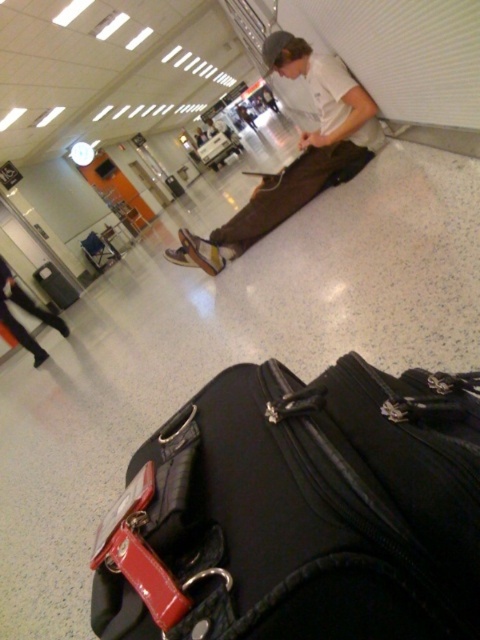
You are a traveler who just arrived at the airport and need to find your luggage. You see a black fabric suitcase at lower center and brown canvas pants at center. Which object is positioned to the left?

The black fabric suitcase at lower center is to the left of brown canvas pants at center, so the black fabric suitcase at lower center is positioned to the left.

You are standing at the camera position and want to pick up the object at point (204, 586). Is the object within reach of your outstretched hand?

The point (204, 586) is 20.83 inches away from the camera, so yes, the object at point (204, 586) is within reach of an outstretched hand since 20.83 inches is approximately 1.73 feet, which is a typical comfortable reaching distance for most adults.

Looking at this image, you are standing in the airport terminal and want to determine the relative positions of two points in the image. Which point, point 1 at coordinates [180,417] or point 2 at [326,122], is closer to you?

Point 1 at coordinates [180,417] is closer to the viewer than point 2 at [326,122].